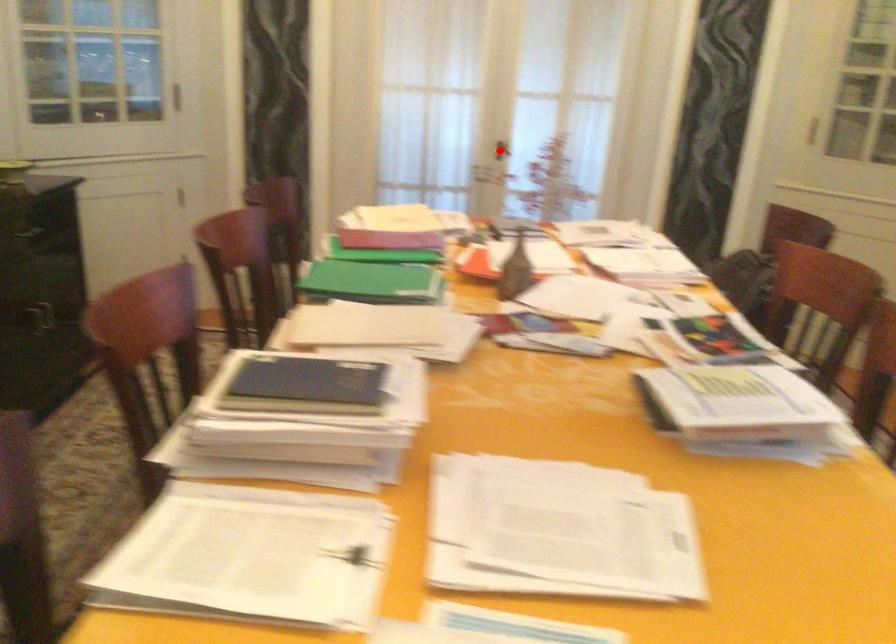
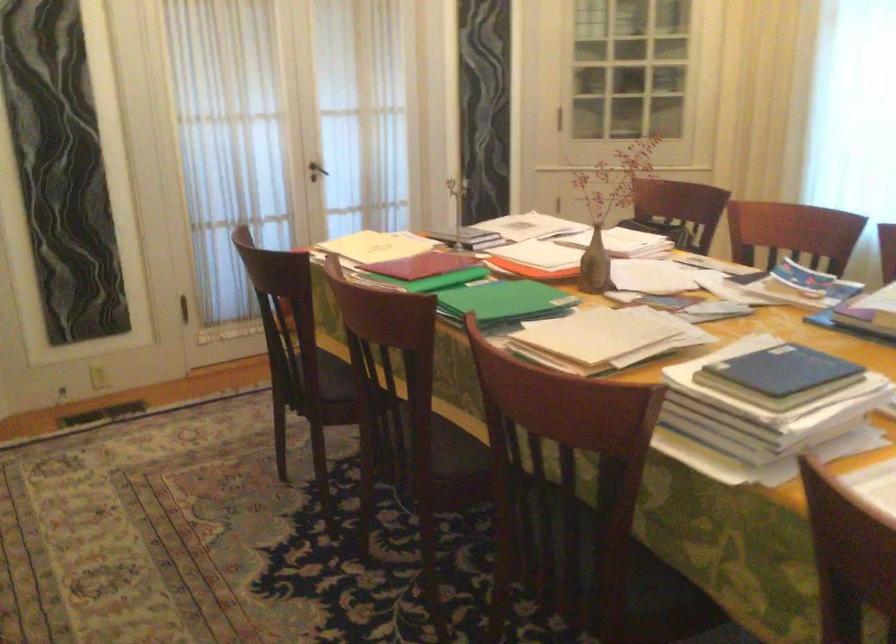
The point at the highlighted location is marked in the first image. Where is the corresponding point in the second image?

(316, 171)